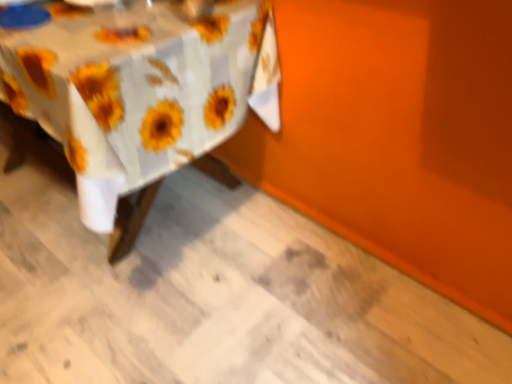
The width and height of the screenshot is (512, 384). Describe the element at coordinates (138, 95) in the screenshot. I see `white fabric table at lower left` at that location.

The image size is (512, 384). In order to click on white fabric table at lower left in this screenshot , I will do `click(138, 95)`.

This screenshot has width=512, height=384. Find the location of `white fabric table at lower left`. white fabric table at lower left is located at coordinates (138, 95).